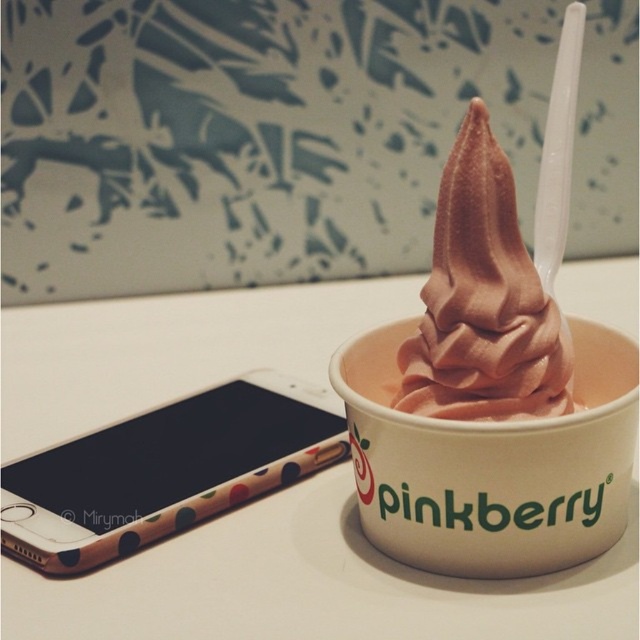
Question: Based on their relative distances, which object is nearer to the white glossy table at center?

Choices:
 (A) chocolate soft serve at center
 (B) polka dot plastic phone at lower left

Answer: (B)

Question: Is white glossy table at center positioned before polka dot plastic phone at lower left?

Choices:
 (A) yes
 (B) no

Answer: (B)

Question: Estimate the real-world distances between objects in this image. Which object is closer to the polka dot plastic phone at lower left?

Choices:
 (A) white glossy table at center
 (B) chocolate soft serve at center

Answer: (A)

Question: Considering the real-world distances, which object is farthest from the white glossy table at center?

Choices:
 (A) chocolate soft serve at center
 (B) polka dot plastic phone at lower left

Answer: (A)

Question: Is polka dot plastic phone at lower left in front of chocolate soft serve at center?

Choices:
 (A) no
 (B) yes

Answer: (A)

Question: Does white glossy table at center have a smaller size compared to polka dot plastic phone at lower left?

Choices:
 (A) no
 (B) yes

Answer: (A)